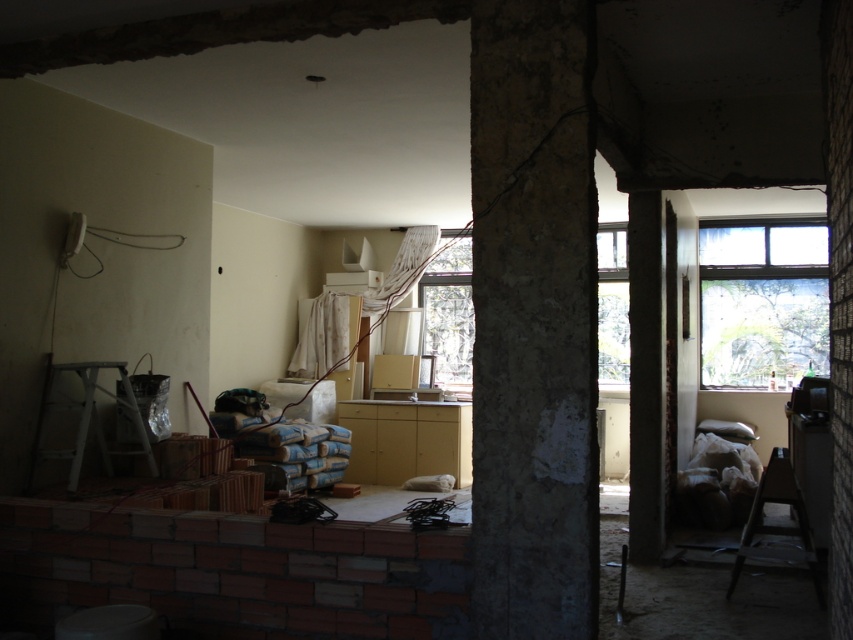
Is point (753, 285) farther from viewer compared to point (61, 372)?

That is True.

Is transparent glass window at upper right closer to camera compared to white matte ladder at lower left?

That is False.

Find the location of a particular element. The width and height of the screenshot is (853, 640). transparent glass window at upper right is located at coordinates (762, 301).

Can you confirm if gray concrete pillar at center is positioned above white matte ladder at lower left?

Correct, gray concrete pillar at center is located above white matte ladder at lower left.

Does gray concrete pillar at center have a larger size compared to white matte ladder at lower left?

Incorrect, gray concrete pillar at center is not larger than white matte ladder at lower left.

This screenshot has height=640, width=853. Describe the element at coordinates (532, 321) in the screenshot. I see `gray concrete pillar at center` at that location.

Where is `gray concrete pillar at center`? gray concrete pillar at center is located at coordinates click(x=532, y=321).

Is point (485, 120) behind point (732, 285)?

No, it is not.

Measure the distance between point (537, 580) and camera.

They are 8.02 feet apart.

The image size is (853, 640). Find the location of `gray concrete pillar at center`. gray concrete pillar at center is located at coordinates (532, 321).